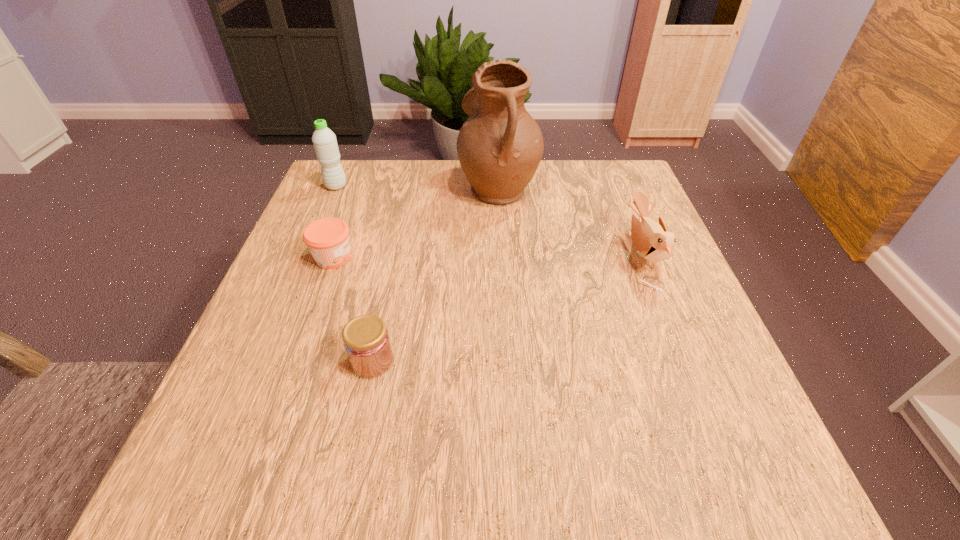
I want to click on free space that satisfies the following two spatial constraints: 1. on the front side of the fourth shortest object; 2. on the left side of the right jam, so click(261, 361).

This screenshot has width=960, height=540. Find the location of `vacant position in the image that satisfies the following two spatial constraints: 1. at the spout of the fourth object from left to right; 2. on the front side of the third object from right to left`. vacant position in the image that satisfies the following two spatial constraints: 1. at the spout of the fourth object from left to right; 2. on the front side of the third object from right to left is located at coordinates (508, 361).

Where is `free space that satisfies the following two spatial constraints: 1. on the front label of the farther jam; 2. on the back side of the nearest object`? This screenshot has height=540, width=960. free space that satisfies the following two spatial constraints: 1. on the front label of the farther jam; 2. on the back side of the nearest object is located at coordinates (297, 361).